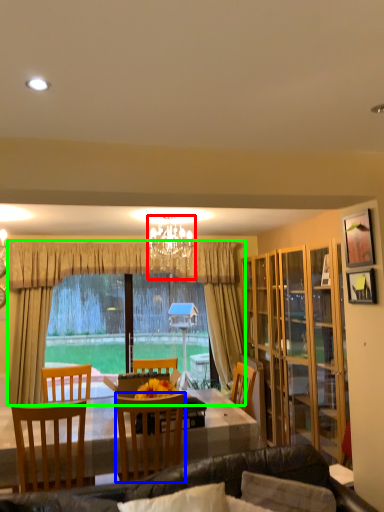
Question: Which object is positioned closest to lamp (highlighted by a red box)? Select from chair (highlighted by a blue box) and curtain (highlighted by a green box).

Choices:
 (A) chair
 (B) curtain

Answer: (B)